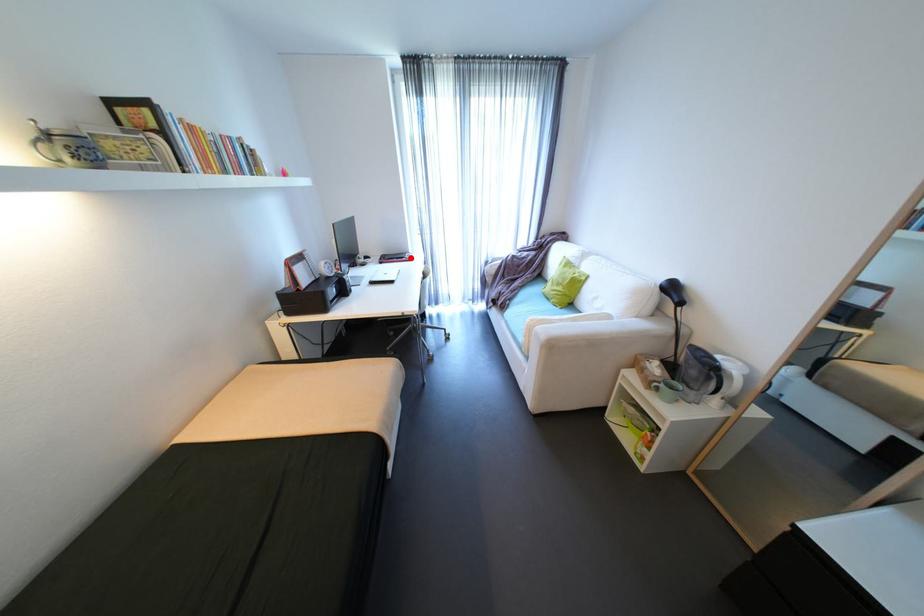
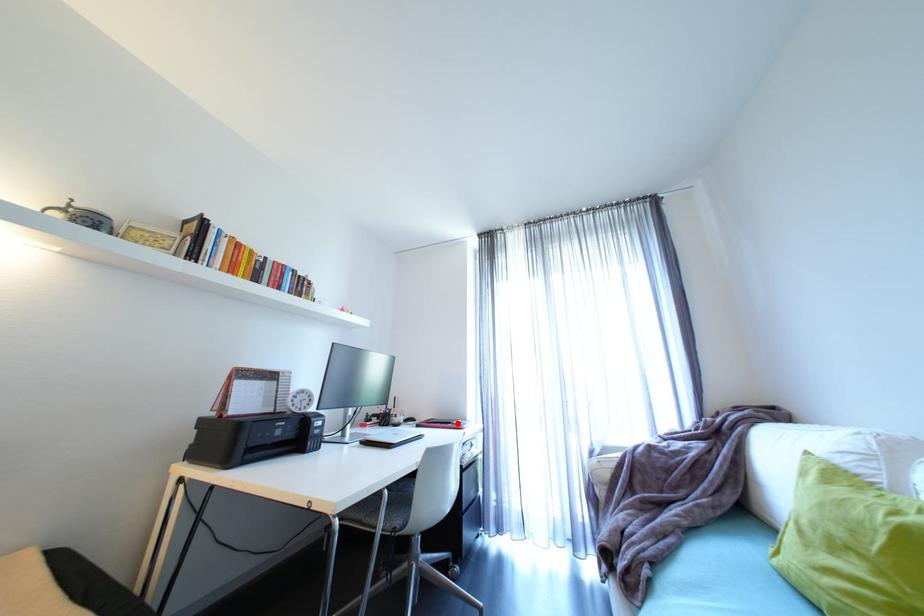
I am providing you with two images of the same scene from different viewpoints. A red point is marked on the first image and another point is marked on the second image. Is the marked point in image1 the same physical position as the marked point in image2?

Yes